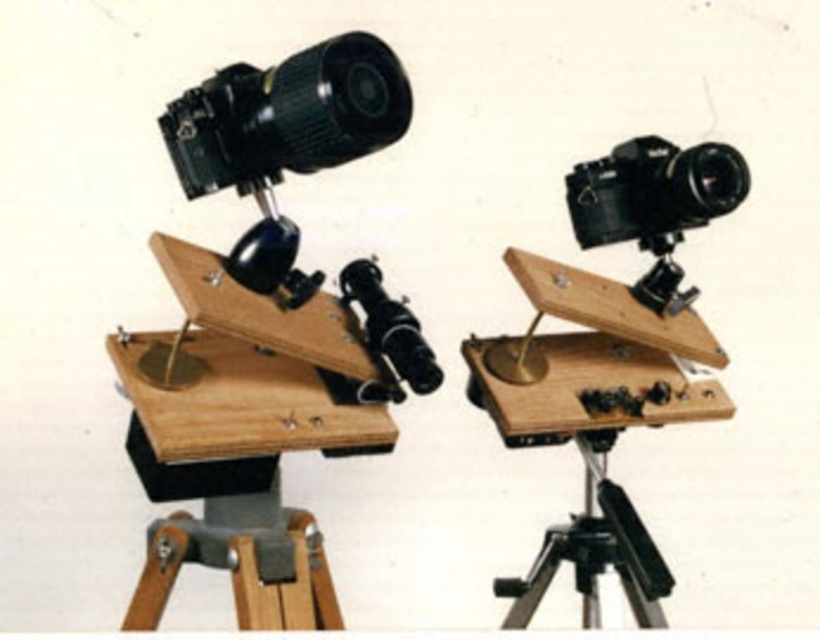
Can you confirm if black matte camera at center is smaller than black metal tripod at lower right?

Yes, black matte camera at center is smaller than black metal tripod at lower right.

Who is lower down, black matte camera at center or black metal tripod at lower right?

black metal tripod at lower right

The width and height of the screenshot is (820, 640). Identify the location of black matte camera at center. (654, 192).

Between point (247, 140) and point (645, 152), which one is positioned in front?

Point (247, 140) is in front.

Who is positioned more to the left, black plastic camera at upper left or black matte camera at center?

black plastic camera at upper left is more to the left.

Describe the element at coordinates (287, 115) in the screenshot. I see `black plastic camera at upper left` at that location.

Where is `black plastic camera at upper left`? This screenshot has height=640, width=820. black plastic camera at upper left is located at coordinates (287, 115).

Can you confirm if black plastic camera at upper left is smaller than black metal tripod at lower right?

Yes, black plastic camera at upper left is smaller than black metal tripod at lower right.

Does black plastic camera at upper left have a larger size compared to black metal tripod at lower right?

No.

The image size is (820, 640). What do you see at coordinates (287, 115) in the screenshot?
I see `black plastic camera at upper left` at bounding box center [287, 115].

You are a GUI agent. You are given a task and a screenshot of the screen. Output one action in this format:
    pyautogui.click(x=<x>, y=<y>)
    Task: Click on the black plastic camera at upper left
    The width and height of the screenshot is (820, 640).
    Given the screenshot: What is the action you would take?
    pyautogui.click(x=287, y=115)